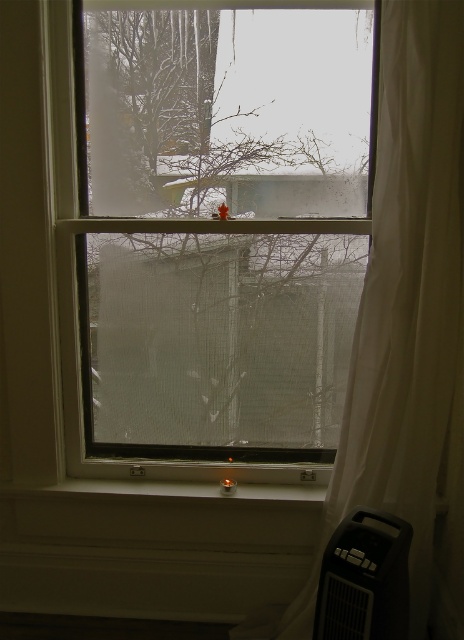
Question: Which of the following is the farthest from the observer?

Choices:
 (A) (360, 324)
 (B) (167, 282)
 (C) (354, 561)

Answer: (B)

Question: Estimate the real-world distances between objects in this image. Which object is farther from the clear glass window at center?

Choices:
 (A) white sheer curtain at right
 (B) black plastic air conditioner at lower right

Answer: (B)

Question: Which object appears closest to the camera in this image?

Choices:
 (A) black plastic air conditioner at lower right
 (B) clear glass window at center

Answer: (A)

Question: Is clear glass window at center to the left of white sheer curtain at right from the viewer's perspective?

Choices:
 (A) no
 (B) yes

Answer: (B)

Question: Is white sheer curtain at right wider than black plastic air conditioner at lower right?

Choices:
 (A) no
 (B) yes

Answer: (B)

Question: Is white sheer curtain at right thinner than black plastic air conditioner at lower right?

Choices:
 (A) yes
 (B) no

Answer: (B)